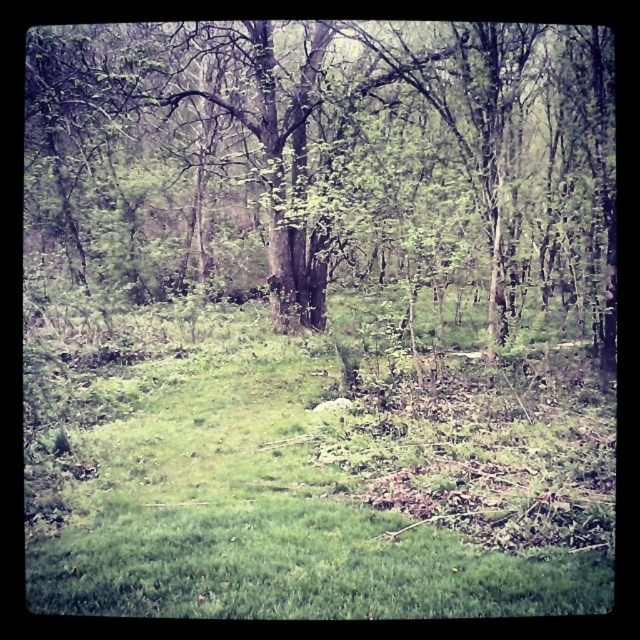
What do you see at coordinates (317, 477) in the screenshot? I see `green grassy at center` at bounding box center [317, 477].

Does point (113, 456) come farther from viewer compared to point (92, 131)?

No.

I want to click on green grassy at center, so click(x=317, y=477).